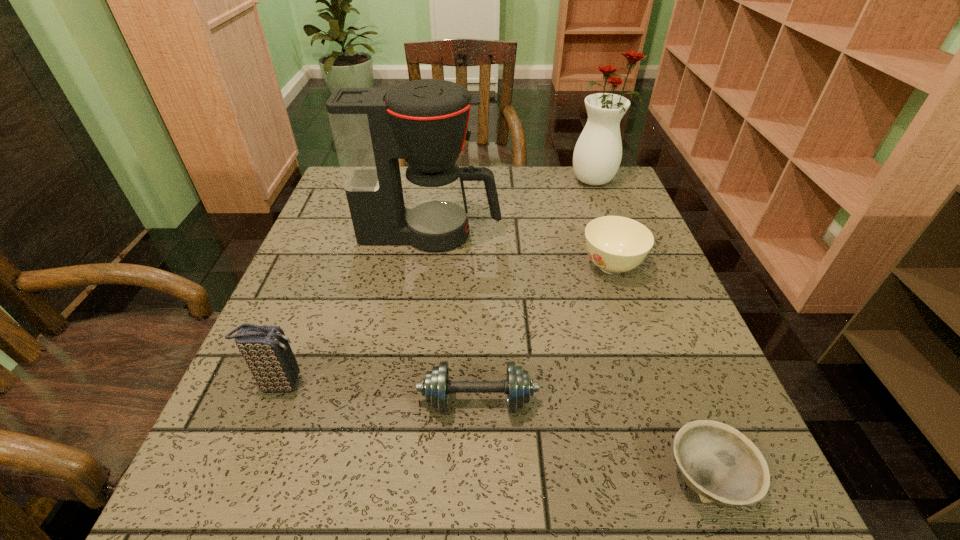
The image size is (960, 540). Find the location of `blank area in the image that satisfies the following two spatial constraints: 1. with the zip open on the fourth shortest object; 2. on the left side of the dumbbell`. blank area in the image that satisfies the following two spatial constraints: 1. with the zip open on the fourth shortest object; 2. on the left side of the dumbbell is located at coordinates coord(272,401).

You are a GUI agent. You are given a task and a screenshot of the screen. Output one action in this format:
    pyautogui.click(x=<x>, y=<y>)
    Task: Click on the vacant point that satisfies the following two spatial constraints: 1. pour from the carafe of the coffee maker; 2. on the right side of the bowl
    
    Given the screenshot: What is the action you would take?
    pyautogui.click(x=396, y=478)

Where is `free space in the image that satisfies the following two spatial constraints: 1. pour from the carafe of the dumbbell; 2. on the left side of the coffee maker`? The height and width of the screenshot is (540, 960). free space in the image that satisfies the following two spatial constraints: 1. pour from the carafe of the dumbbell; 2. on the left side of the coffee maker is located at coordinates (407, 401).

At what (x,y) coordinates should I click in order to perform the action: click on vacant space that satisfies the following two spatial constraints: 1. with the zip open on the fourth shortest object; 2. on the right side of the dumbbell. Please return your answer as a coordinate pair (x, y). Looking at the image, I should click on (272, 401).

At what (x,y) coordinates should I click in order to perform the action: click on vacant space that satisfies the following two spatial constraints: 1. on the front side of the sugar bowl; 2. on the left side of the shortest object. Please return your answer as a coordinate pair (x, y). This screenshot has width=960, height=540. Looking at the image, I should click on (683, 478).